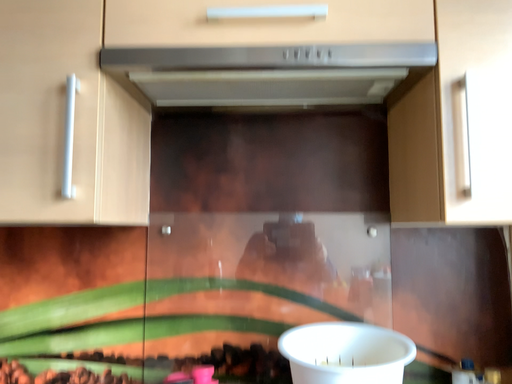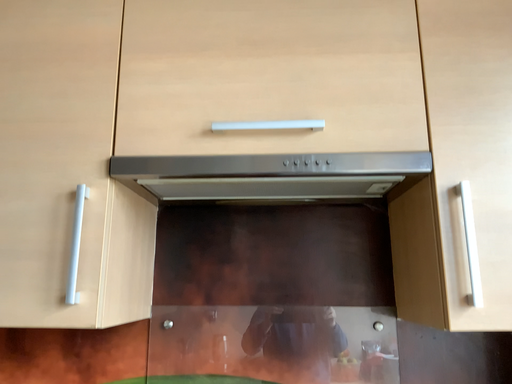
Question: Which way did the camera rotate in the video?

Choices:
 (A) rotated downward
 (B) rotated upward

Answer: (B)